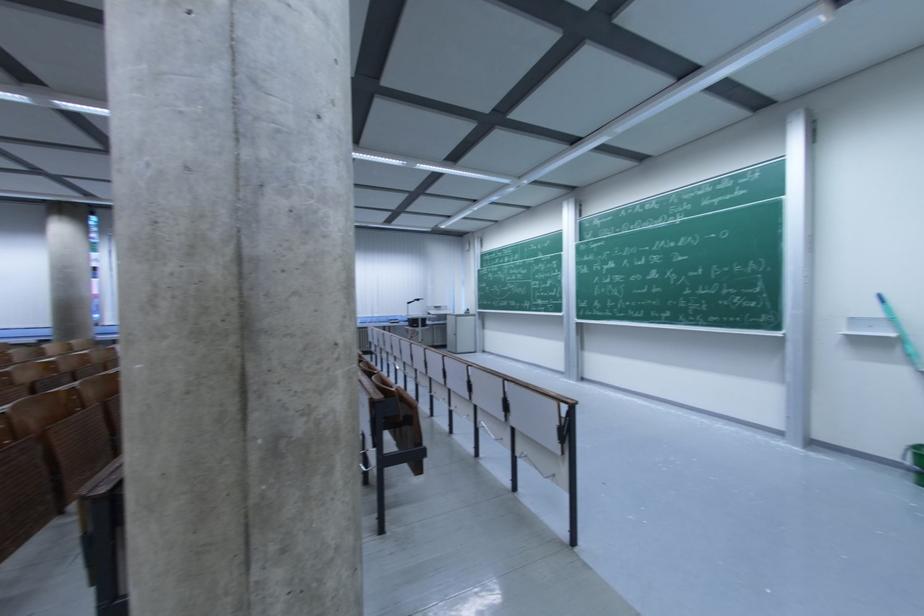
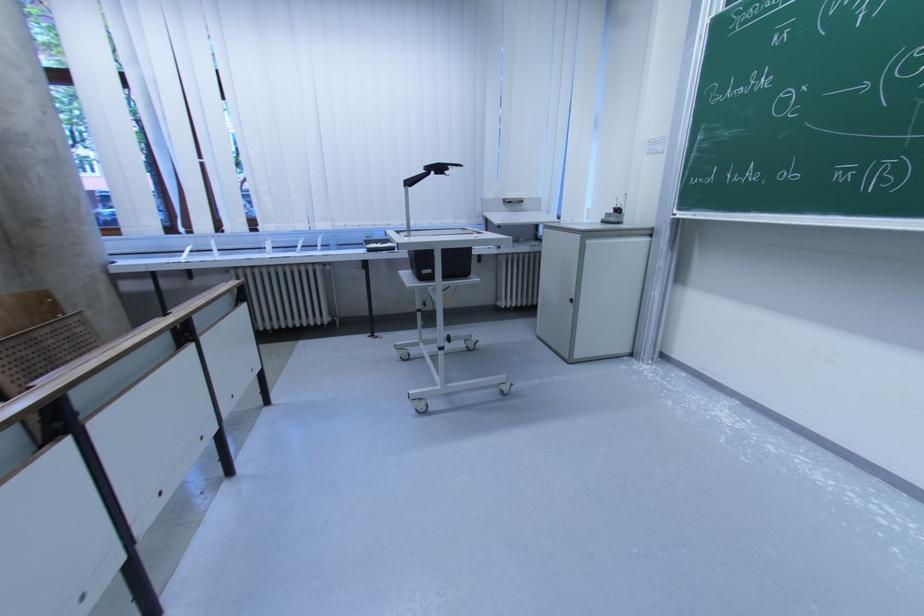
Where in the second image is the point corresponding to point (472, 312) from the first image?

(622, 213)